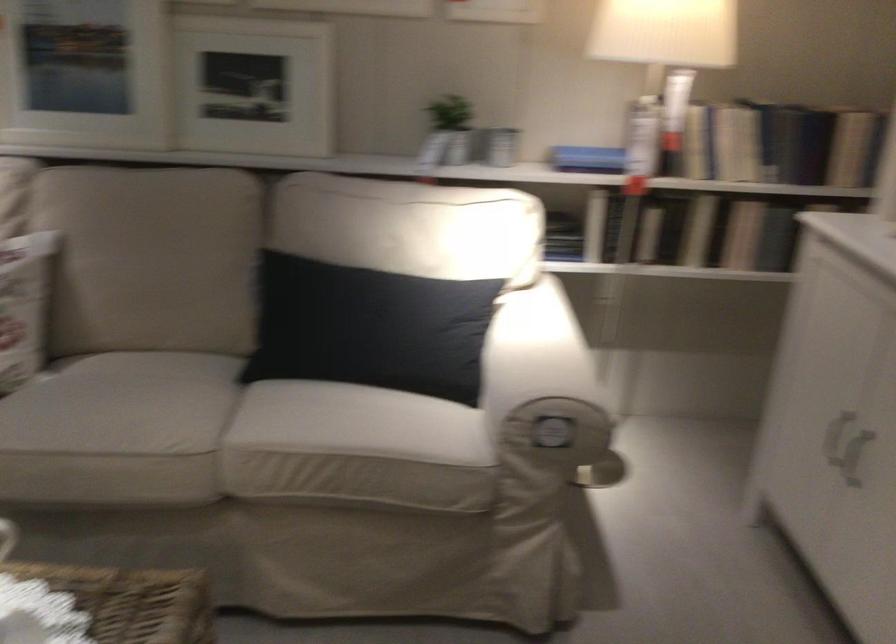
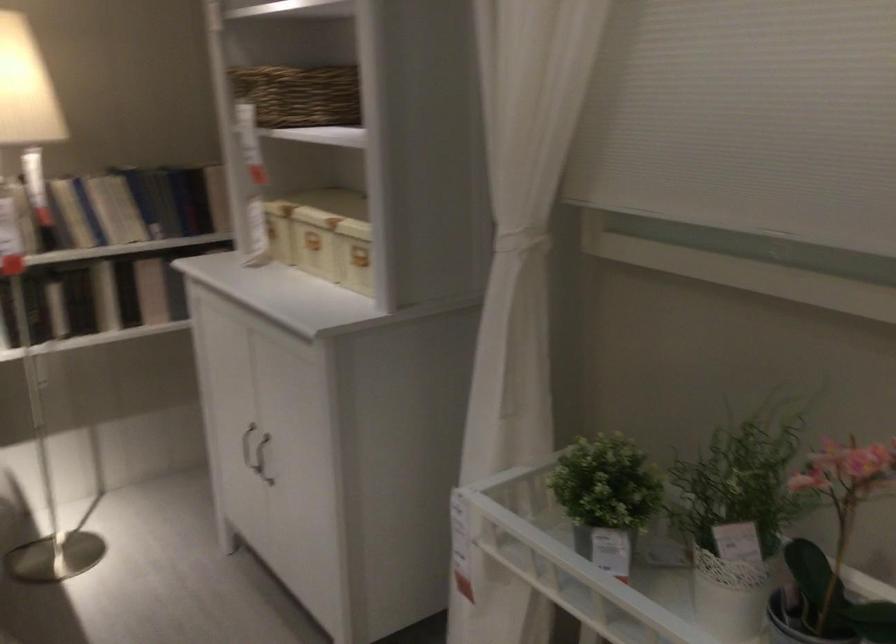
In the second image, find the point that corresponds to point 656,223 in the first image.

(55, 307)